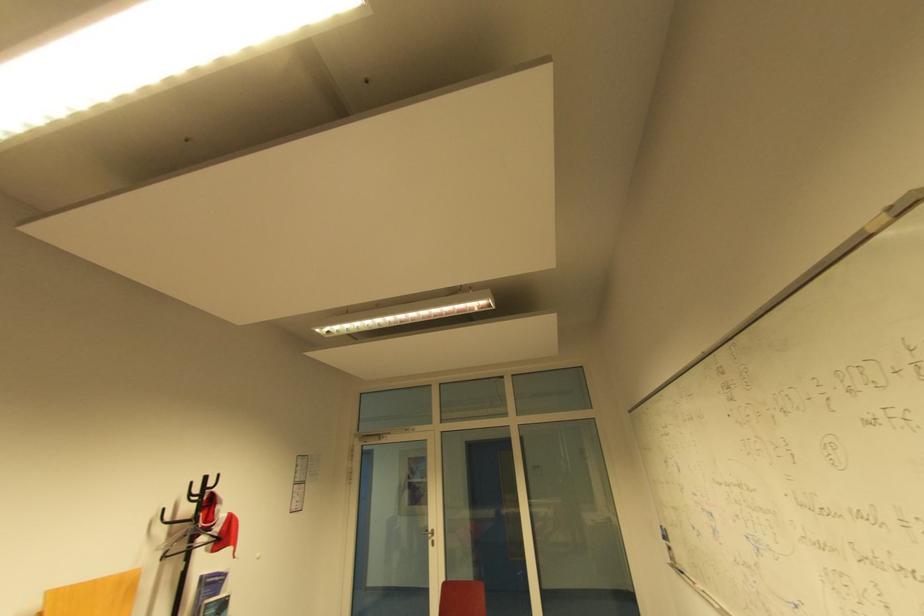
Where would you hang the black clothes hanger? Please return your answer as a coordinate pair (x, y).

(207, 538)